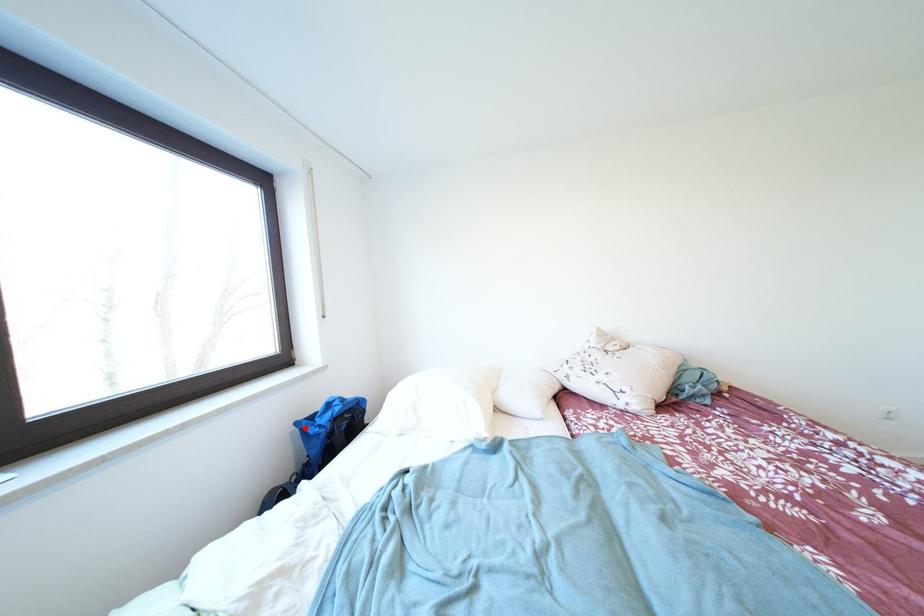
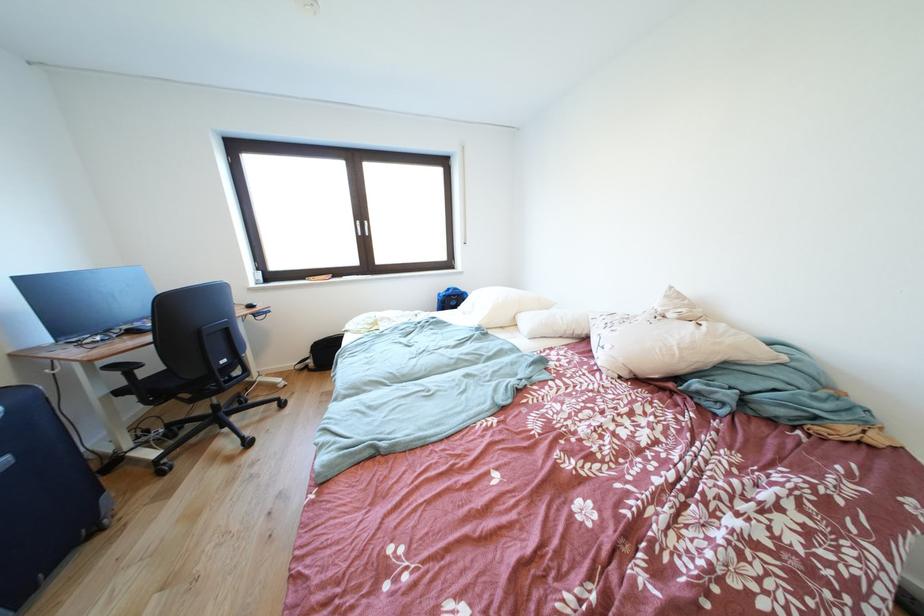
Question: I am providing you with two images of the same scene from different viewpoints. In image1, a red point is highlighted. Considering the same 3D point in image2, which of the following is correct?

Choices:
 (A) It is closer
 (B) It is farther

Answer: (A)